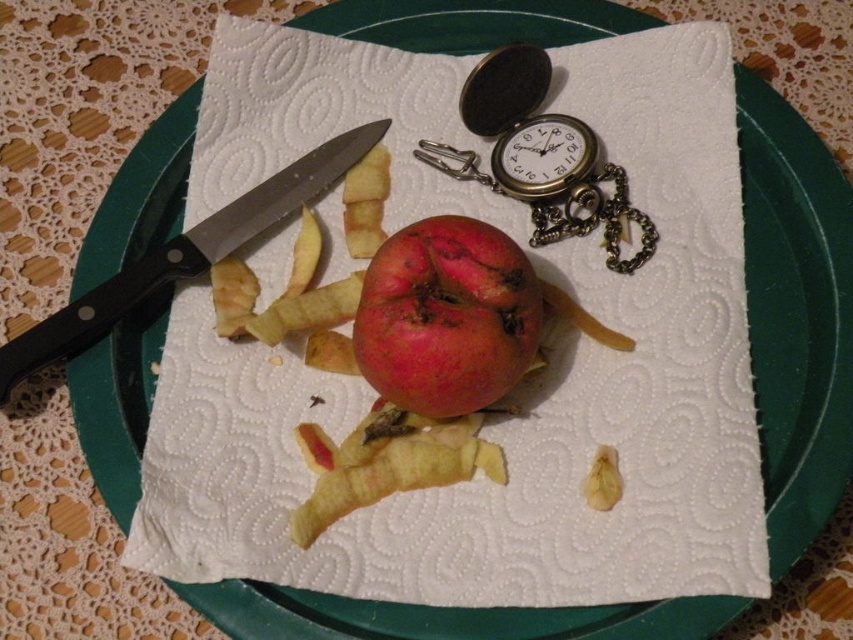
You are a photographer taking a close up of the green plate on the table. You want to focus on the object at point (566, 134) and the object at point (167, 253). Which point should you adjust your focus to first if you want to capture both clearly in the same shot?

Since point (566, 134) is further to the camera than point (167, 253), you should focus on point (566, 134) first to ensure both are in focus.

Where is the rotten red apple at center located in the image?

The rotten red apple at center is located at point (445, 316) in the image.